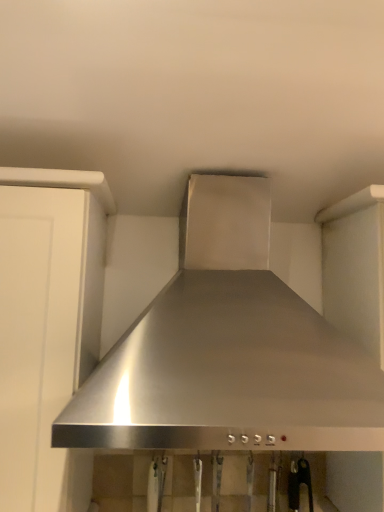
The image size is (384, 512). What are the coordinates of `white matte cabinet at left` in the screenshot? It's located at (47, 323).

Image resolution: width=384 pixels, height=512 pixels. What do you see at coordinates (47, 323) in the screenshot?
I see `white matte cabinet at left` at bounding box center [47, 323].

Describe the element at coordinates (228, 350) in the screenshot. I see `stainless steel range hood at center` at that location.

What is the approximate height of stainless steel range hood at center?

It is 20.32 inches.

At what (x,y) coordinates should I click in order to perform the action: click on stainless steel range hood at center. Please return your answer as a coordinate pair (x, y). Looking at the image, I should click on (228, 350).

Locate an element on the screen. white matte cabinet at left is located at coordinates (47, 323).

Is white matte cabinet at left at the right side of stainless steel range hood at center?

No, white matte cabinet at left is not to the right of stainless steel range hood at center.

Considering the positions of objects white matte cabinet at left and stainless steel range hood at center in the image provided, who is behind, white matte cabinet at left or stainless steel range hood at center?

white matte cabinet at left is further from the camera.

Which point is more forward, (x=78, y=231) or (x=213, y=354)?

The point (x=213, y=354) is in front.

From the image's perspective, relative to stainless steel range hood at center, is white matte cabinet at left above or below?

Based on their image positions, white matte cabinet at left is located beneath stainless steel range hood at center.

From a real-world perspective, is white matte cabinet at left positioned over stainless steel range hood at center based on gravity?

No.

Considering the relative sizes of white matte cabinet at left and stainless steel range hood at center in the image provided, is white matte cabinet at left wider than stainless steel range hood at center?

No.

Looking at this image, considering the sizes of objects white matte cabinet at left and stainless steel range hood at center in the image provided, who is taller, white matte cabinet at left or stainless steel range hood at center?

white matte cabinet at left is taller.

Based on their sizes in the image, would you say white matte cabinet at left is bigger or smaller than stainless steel range hood at center?

white matte cabinet at left is smaller than stainless steel range hood at center.

Is white matte cabinet at left spatially inside stainless steel range hood at center, or outside of it?

The correct answer is: outside.

Would you consider white matte cabinet at left to be distant from stainless steel range hood at center?

No.

Could you tell me if white matte cabinet at left is turned towards stainless steel range hood at center?

No, white matte cabinet at left is not facing towards stainless steel range hood at center.

Based on the photo, can you tell me how much white matte cabinet at left and stainless steel range hood at center differ in facing direction?

The angular difference between white matte cabinet at left and stainless steel range hood at center is 0.00128 degrees.

How distant is white matte cabinet at left from stainless steel range hood at center?

white matte cabinet at left is 27.68 centimeters away from stainless steel range hood at center.

This screenshot has width=384, height=512. I want to click on cabinetry below the stainless steel range hood at center (from the image's perspective), so click(47, 323).

Considering the positions of objects stainless steel range hood at center and white matte cabinet at left in the image provided, who is more to the right, stainless steel range hood at center or white matte cabinet at left?

stainless steel range hood at center is more to the right.

Is stainless steel range hood at center in front of white matte cabinet at left?

Yes, it is.

Which is less distant, [132,440] or [97,210]?

The point [132,440] is closer.

From the image's perspective, would you say stainless steel range hood at center is shown under white matte cabinet at left?

Actually, stainless steel range hood at center appears above white matte cabinet at left in the image.

From a real-world perspective, which is physically below, stainless steel range hood at center or white matte cabinet at left?

In real-world perspective, white matte cabinet at left is lower.

Considering the sizes of objects stainless steel range hood at center and white matte cabinet at left in the image provided, who is thinner, stainless steel range hood at center or white matte cabinet at left?

Thinner between the two is white matte cabinet at left.

Which of these two, stainless steel range hood at center or white matte cabinet at left, stands taller?

white matte cabinet at left.

Who is smaller, stainless steel range hood at center or white matte cabinet at left?

Smaller between the two is white matte cabinet at left.

Could white matte cabinet at left be considered to be inside stainless steel range hood at center?

No.

Is stainless steel range hood at center far from white matte cabinet at left?

Actually, stainless steel range hood at center and white matte cabinet at left are a little close together.

Is stainless steel range hood at center looking in the opposite direction of white matte cabinet at left?

That's not correct — stainless steel range hood at center is not looking away from white matte cabinet at left.

Measure the distance from stainless steel range hood at center to white matte cabinet at left.

stainless steel range hood at center and white matte cabinet at left are 27.68 centimeters apart.

In order to click on cabinetry that appears below the stainless steel range hood at center (from a real-world perspective) in this screenshot , I will do `click(47, 323)`.

In order to click on cabinetry to the left of stainless steel range hood at center in this screenshot , I will do `click(47, 323)`.

You are a GUI agent. You are given a task and a screenshot of the screen. Output one action in this format:
    pyautogui.click(x=<x>, y=<y>)
    Task: Click on the home appliance lying in front of the white matte cabinet at left
    The width and height of the screenshot is (384, 512).
    Given the screenshot: What is the action you would take?
    pyautogui.click(x=228, y=350)